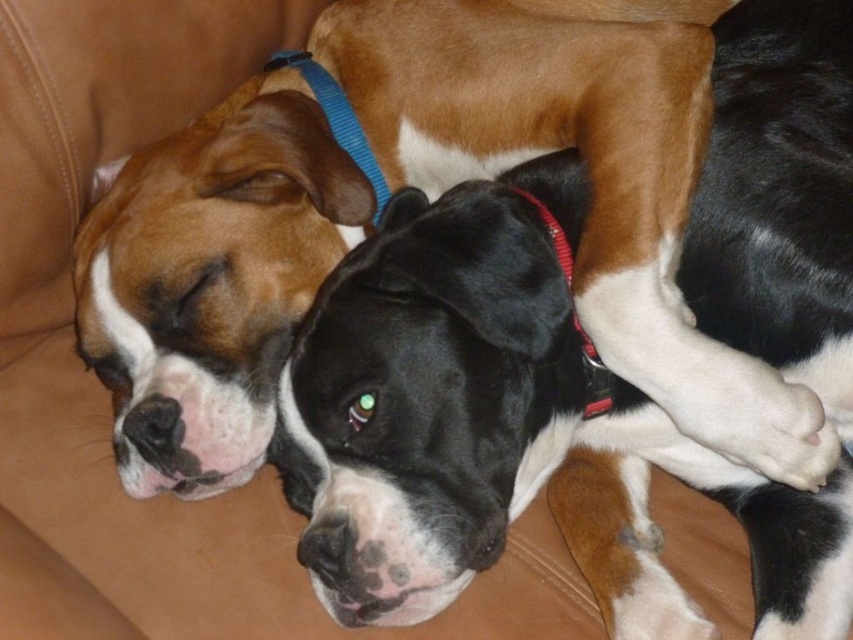
You are a photographer trying to capture a closeup of the black glossy dog at center and the blue fabric neckband at upper center. From the current angle, which object is positioned to the right side of the other?

The black glossy dog at center is positioned to the right of the blue fabric neckband at upper center.

You are a photographer setting up a shoot in a room with two dogs, the black glossy dog at center and the matte black dog at center. You want to take a photo where both dogs are visible. Which dog should you position closer to the light source to create a more reflective surface?

The black glossy dog at center should be positioned closer to the light source because its glossy coat will reflect light more effectively than the matte black dog at center.

You are a dog owner who wants to buy a new collar for your matte black dog at center. The store has a collar that is exactly the same width as the red fabric collar at center. Will this new collar be too small for your dog?

The matte black dog at center is wider than the red fabric collar at center, so the new collar with the same width as the red fabric collar at center will be too small for the matte black dog at center.